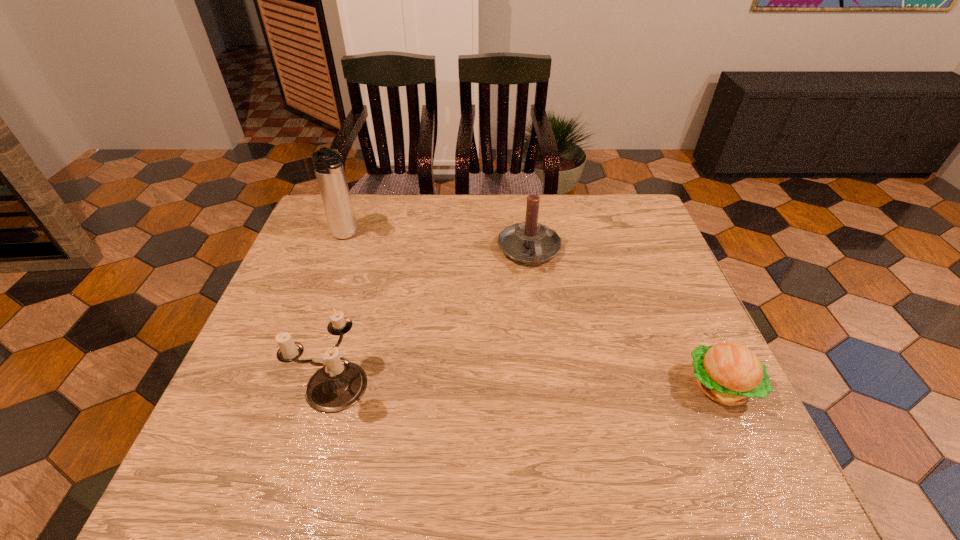
Find the location of a particular element. free space located 0.200m on the side of the second object from right to left with the handle loop is located at coordinates (552, 330).

Locate an element on the screen. vacant region located 0.090m on the side of the second object from right to left with the handle loop is located at coordinates (542, 298).

You are a GUI agent. You are given a task and a screenshot of the screen. Output one action in this format:
    pyautogui.click(x=<x>, y=<y>)
    Task: Click on the vacant space located 0.350m on the side of the second object from right to left with the handle loop
    The width and height of the screenshot is (960, 540).
    Given the screenshot: What is the action you would take?
    pyautogui.click(x=567, y=383)

The width and height of the screenshot is (960, 540). What are the coordinates of `thermos bottle that is positioned at the far edge` in the screenshot? It's located at (328, 166).

You are a GUI agent. You are given a task and a screenshot of the screen. Output one action in this format:
    pyautogui.click(x=<x>, y=<y>)
    Task: Click on the candle situated at the far edge
    Image resolution: width=960 pixels, height=540 pixels.
    Given the screenshot: What is the action you would take?
    pyautogui.click(x=529, y=242)

Image resolution: width=960 pixels, height=540 pixels. Identify the location of candle holder located in the near edge section of the desktop. (339, 384).

The image size is (960, 540). Identify the location of hamburger at the near edge. (729, 373).

Where is `candle holder that is positioned at the left edge`? candle holder that is positioned at the left edge is located at coordinates (339, 384).

At what (x,y) coordinates should I click in order to perform the action: click on thermos bottle located at the left edge. Please return your answer as a coordinate pair (x, y). This screenshot has width=960, height=540. Looking at the image, I should click on (328, 166).

You are a GUI agent. You are given a task and a screenshot of the screen. Output one action in this format:
    pyautogui.click(x=<x>, y=<y>)
    Task: Click on the object located at the right edge
    This screenshot has height=540, width=960.
    Given the screenshot: What is the action you would take?
    pyautogui.click(x=729, y=373)